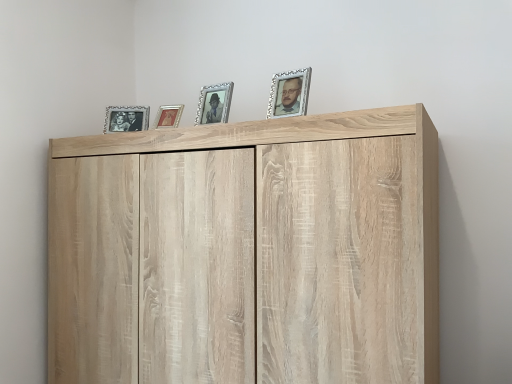
Question: Is the depth of matte silver picture frame at upper left, which is the 1th picture frame in left-to-right order, less than that of metallic gold picture frame at center, the 3th picture frame viewed from the front?

Choices:
 (A) no
 (B) yes

Answer: (A)

Question: Is matte silver picture frame at upper left, which is the 1th picture frame in left-to-right order, placed right next to metallic gold picture frame at center, the 3th picture frame viewed from the front?

Choices:
 (A) yes
 (B) no

Answer: (B)

Question: Does matte silver picture frame at upper left, which is the 1th picture frame in left-to-right order, appear on the right side of metallic gold picture frame at center, the 3th picture frame viewed from the front?

Choices:
 (A) yes
 (B) no

Answer: (B)

Question: Is metallic gold picture frame at center, the 3th picture frame viewed from the front, a part of matte silver picture frame at upper left, which is the 1th picture frame from back to front?

Choices:
 (A) no
 (B) yes

Answer: (A)

Question: Is matte silver picture frame at upper left, which is the 1th picture frame in left-to-right order, aimed at metallic gold picture frame at center, the 3th picture frame viewed from the front?

Choices:
 (A) yes
 (B) no

Answer: (B)

Question: Is matte silver picture frame at upper left, which ranks as the fourth picture frame in right-to-left order, not near metallic gold picture frame at center, the third picture frame viewed from the right?

Choices:
 (A) no
 (B) yes

Answer: (A)

Question: Is matte silver picture frame at upper left, which is the 1th picture frame from back to front, to the right of light wood cupboard at upper center from the viewer's perspective?

Choices:
 (A) no
 (B) yes

Answer: (A)

Question: Does matte silver picture frame at upper left, which is the 1th picture frame in left-to-right order, have a lesser width compared to light wood cupboard at upper center?

Choices:
 (A) no
 (B) yes

Answer: (B)

Question: Does matte silver picture frame at upper left, which is the fourth picture frame from front to back, have a greater height compared to light wood cupboard at upper center?

Choices:
 (A) yes
 (B) no

Answer: (B)

Question: Considering the relative positions of matte silver picture frame at upper left, which is the fourth picture frame from front to back, and light wood cupboard at upper center in the image provided, is matte silver picture frame at upper left, which is the fourth picture frame from front to back, behind light wood cupboard at upper center?

Choices:
 (A) yes
 (B) no

Answer: (A)

Question: Is matte silver picture frame at upper left, which is the 1th picture frame from back to front, not within light wood cupboard at upper center?

Choices:
 (A) no
 (B) yes

Answer: (B)

Question: Does matte silver picture frame at upper left, which ranks as the fourth picture frame in right-to-left order, come in front of light wood cupboard at upper center?

Choices:
 (A) no
 (B) yes

Answer: (A)

Question: Does matte silver picture frame at upper left, which is the 1th picture frame from back to front, have a greater height compared to silver/glass picture frame at upper right, arranged as the 1th picture frame when viewed from the front?

Choices:
 (A) yes
 (B) no

Answer: (B)